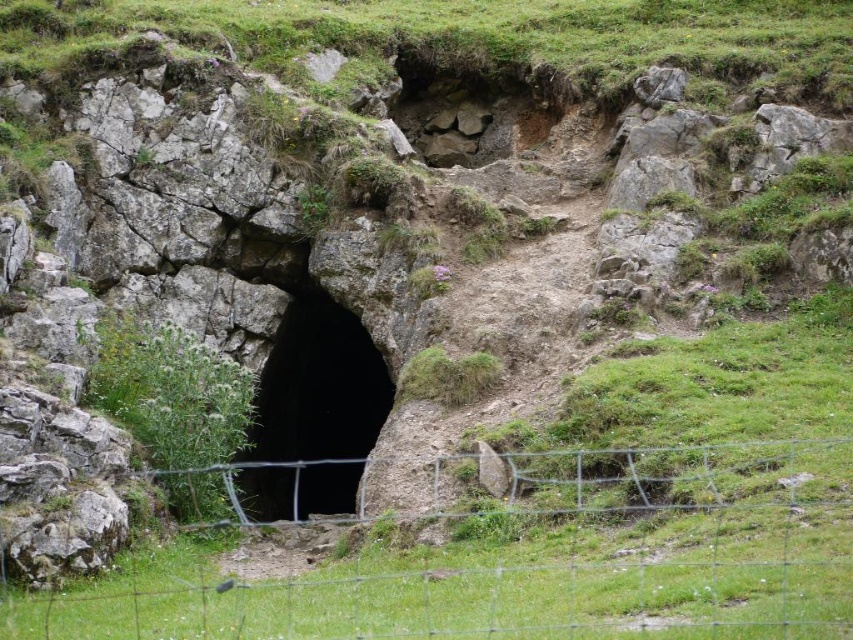
You are a hiker who wants to enter the cave through the black rock hole at center. You notice a wire mesh fence at center blocking your path. Can you step over the fence to reach the cave entrance?

The wire mesh fence at center is closer to the viewer than the black rock hole at center, so you can step over the wire mesh fence at center to reach the black rock hole at center.

You are a park ranger standing at the camera position. You need to check the distance between the wire mesh fence at center and the cave entrance. Can you reach the cave entrance without crossing the fence?

The wire mesh fence at center is 74.84 feet away from the camera. Since the fence is in the foreground and the cave entrance is further back, you would have to cross the fence to reach the cave entrance.